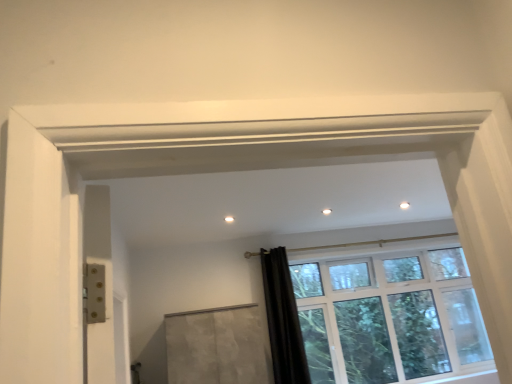
Question: Does matte concrete screen door at center touch black velvet curtain at lower right?

Choices:
 (A) yes
 (B) no

Answer: (B)

Question: Does matte concrete screen door at center have a lesser height compared to black velvet curtain at lower right?

Choices:
 (A) no
 (B) yes

Answer: (B)

Question: Is matte concrete screen door at center looking in the opposite direction of black velvet curtain at lower right?

Choices:
 (A) no
 (B) yes

Answer: (A)

Question: Does matte concrete screen door at center have a larger size compared to black velvet curtain at lower right?

Choices:
 (A) yes
 (B) no

Answer: (A)

Question: Would you say matte concrete screen door at center is a long distance from black velvet curtain at lower right?

Choices:
 (A) no
 (B) yes

Answer: (A)

Question: Visually, is black velvet curtain at lower right positioned to the left or to the right of clear glass window at center?

Choices:
 (A) right
 (B) left

Answer: (B)

Question: Is point (271, 299) closer or farther from the camera than point (431, 279)?

Choices:
 (A) farther
 (B) closer

Answer: (B)

Question: From a real-world perspective, is black velvet curtain at lower right positioned above or below clear glass window at center?

Choices:
 (A) above
 (B) below

Answer: (A)

Question: Looking at their shapes, would you say black velvet curtain at lower right is wider or thinner than clear glass window at center?

Choices:
 (A) thin
 (B) wide

Answer: (A)

Question: From the image's perspective, relative to matte concrete screen door at center, is black velvet curtain at lower right above or below?

Choices:
 (A) above
 (B) below

Answer: (A)

Question: Considering their positions, is black velvet curtain at lower right located in front of or behind matte concrete screen door at center?

Choices:
 (A) behind
 (B) front

Answer: (A)

Question: Is black velvet curtain at lower right spatially inside matte concrete screen door at center, or outside of it?

Choices:
 (A) inside
 (B) outside

Answer: (B)

Question: In the image, is black velvet curtain at lower right on the left side or the right side of matte concrete screen door at center?

Choices:
 (A) right
 (B) left

Answer: (A)

Question: Visually, is matte concrete screen door at center positioned to the left or to the right of clear glass window at center?

Choices:
 (A) right
 (B) left

Answer: (B)

Question: Looking at the image, does matte concrete screen door at center seem bigger or smaller compared to clear glass window at center?

Choices:
 (A) big
 (B) small

Answer: (B)